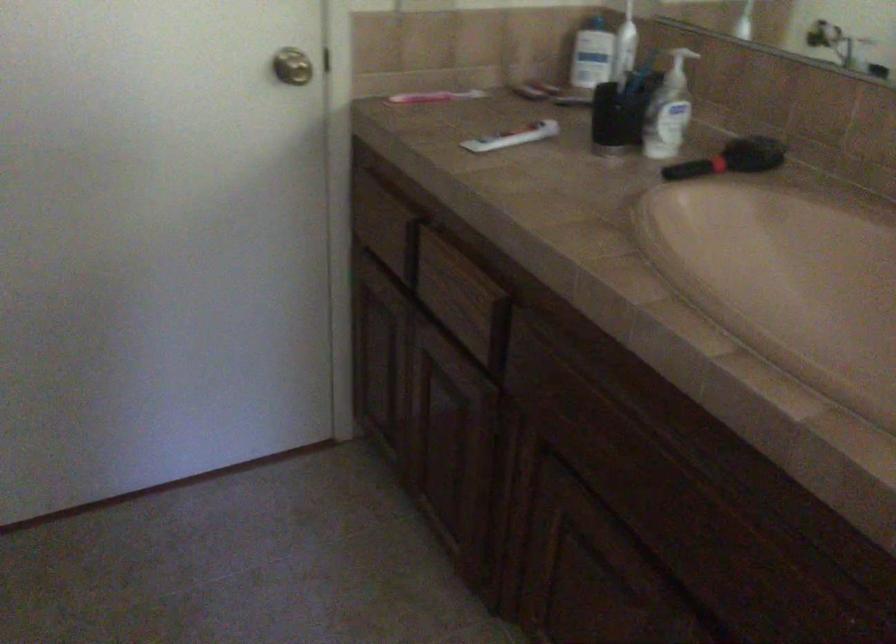
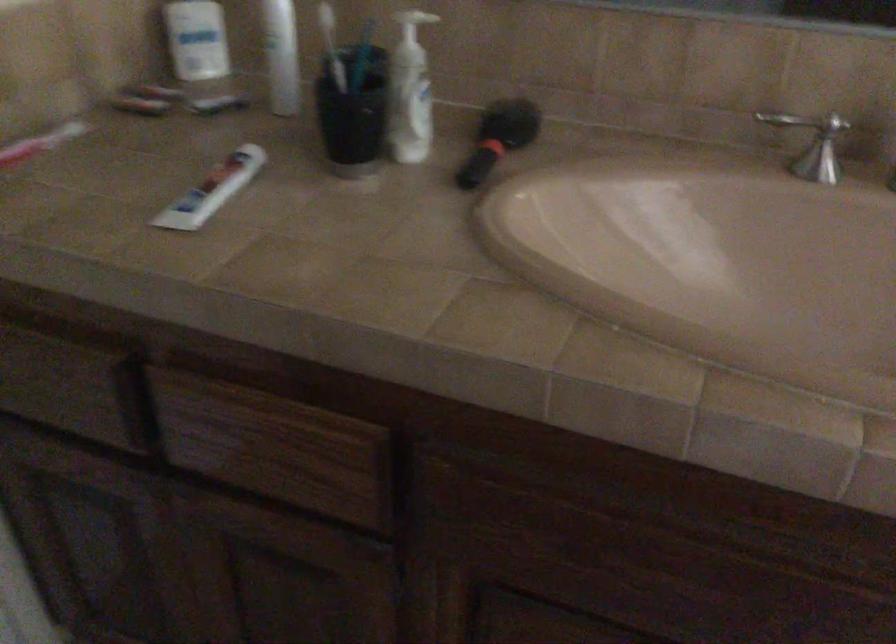
Where in the second image is the point corresponding to point 451,91 from the first image?

(42, 145)